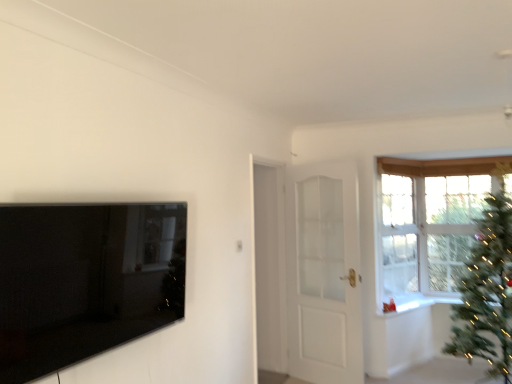
Question: Is white glossy door at center in front of or behind green matte christmas tree at right in the image?

Choices:
 (A) front
 (B) behind

Answer: (B)

Question: Is white glossy door at center wider or thinner than green matte christmas tree at right?

Choices:
 (A) thin
 (B) wide

Answer: (A)

Question: Which object is positioned closest to the clear glass window at upper right?

Choices:
 (A) white glossy door at center
 (B) green matte christmas tree at right
 (C) black glossy tv at left
 (D) white glossy door at center
 (E) white glossy window sill at upper right

Answer: (E)

Question: Based on their relative distances, which object is farther from the black glossy tv at left?

Choices:
 (A) white glossy door at center
 (B) clear glass window at upper right
 (C) green matte christmas tree at right
 (D) white glossy door at center
 (E) white glossy window sill at upper right

Answer: (B)